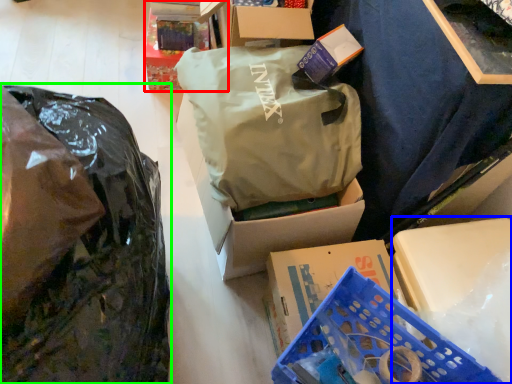
Question: Which is farther away from box (highlighted by a red box)? storage box (highlighted by a blue box) or plastic bag (highlighted by a green box)?

Choices:
 (A) storage box
 (B) plastic bag

Answer: (A)